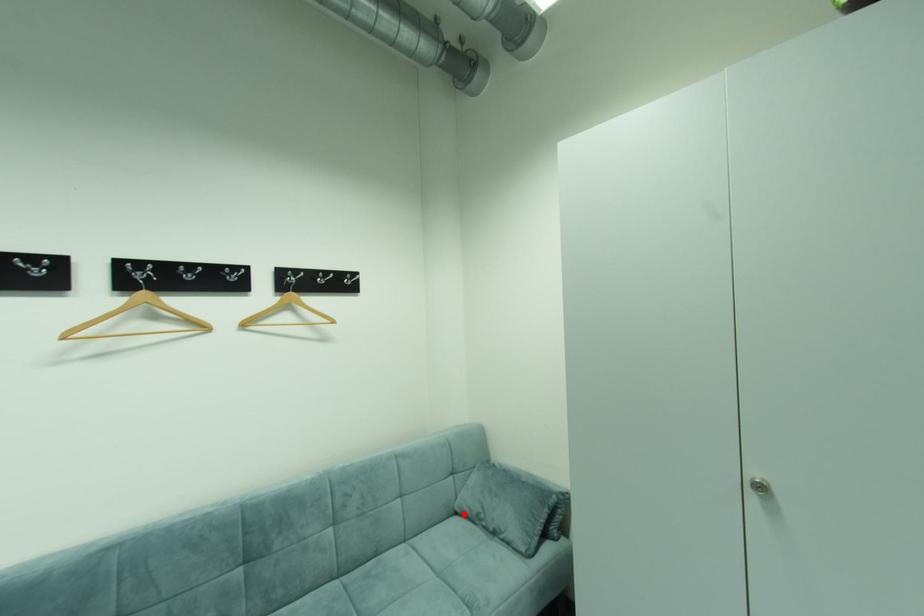
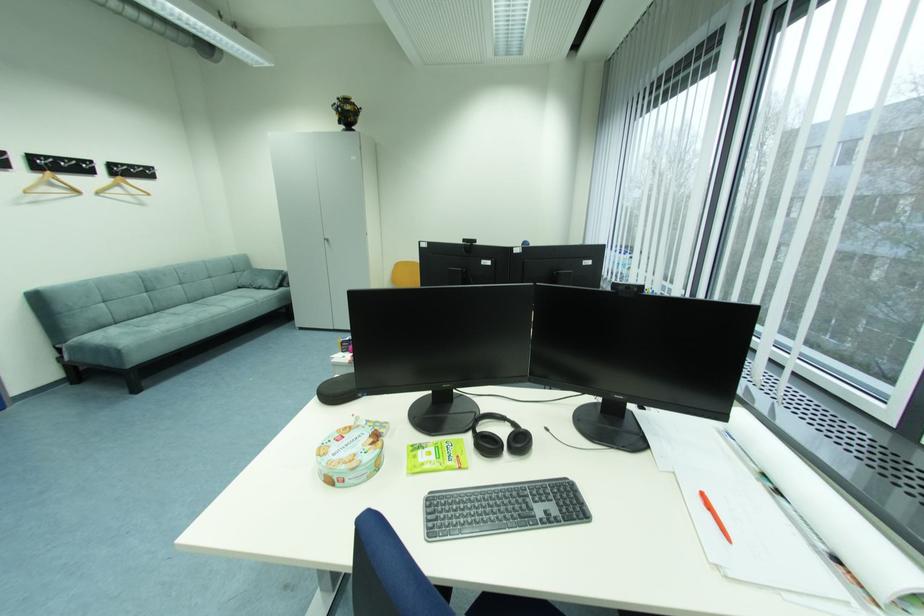
Question: I am providing you with two images of the same scene from different viewpoints. Given a red point in image1, look at the same physical point in image2. Is it:

Choices:
 (A) Closer to the viewpoint
 (B) Farther from the viewpoint

Answer: (A)